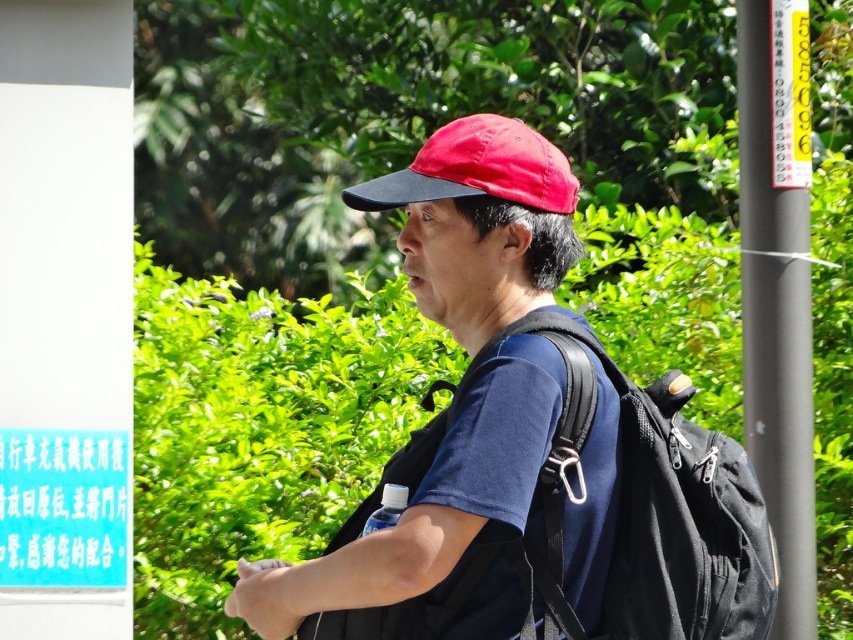
Question: Which object is the closest to the transparent plastic bottle at lower center?

Choices:
 (A) black matte pole at right
 (B) matte blue shirt at center
 (C) black fabric backpack at center
 (D) red fabric baseball cap at center

Answer: (B)

Question: Which of the following is the farthest from the observer?

Choices:
 (A) (439, 195)
 (B) (380, 522)
 (C) (412, 214)

Answer: (C)

Question: Which object is positioned farthest from the red fabric baseball cap at center?

Choices:
 (A) matte blue shirt at center
 (B) black fabric backpack at center
 (C) black matte pole at right
 (D) transparent plastic bottle at lower center

Answer: (C)

Question: Observing the image, what is the correct spatial positioning of black matte pole at right in reference to transparent plastic bottle at lower center?

Choices:
 (A) right
 (B) left

Answer: (A)

Question: Does black fabric backpack at center have a larger size compared to red fabric baseball cap at center?

Choices:
 (A) no
 (B) yes

Answer: (B)

Question: Does black matte pole at right appear on the right side of transparent plastic bottle at lower center?

Choices:
 (A) yes
 (B) no

Answer: (A)